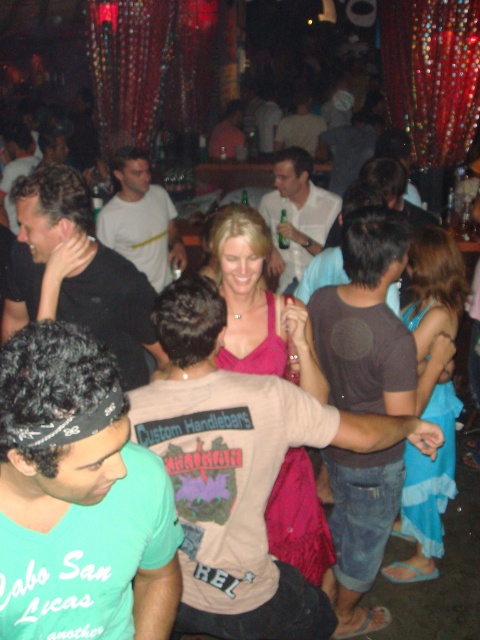
Question: Which object appears farthest from the camera in this image?

Choices:
 (A) white matte shirt at center
 (B) light brown t-shirt at center

Answer: (A)

Question: Does teal t-shirt at lower left have a smaller size compared to white matte shirt at center?

Choices:
 (A) no
 (B) yes

Answer: (B)

Question: Is white cotton t-shirt at center in front of matte black shirt at center?

Choices:
 (A) yes
 (B) no

Answer: (A)

Question: Is white cotton t-shirt at center further to the viewer compared to matte black shirt at center?

Choices:
 (A) yes
 (B) no

Answer: (B)

Question: Among these points, which one is farthest from the camera?

Choices:
 (A) (299, 113)
 (B) (87, 296)
 (C) (230, 109)
 (D) (100, 221)

Answer: (C)

Question: Which point appears farthest from the camera in this image?

Choices:
 (A) (277, 240)
 (B) (282, 134)

Answer: (B)